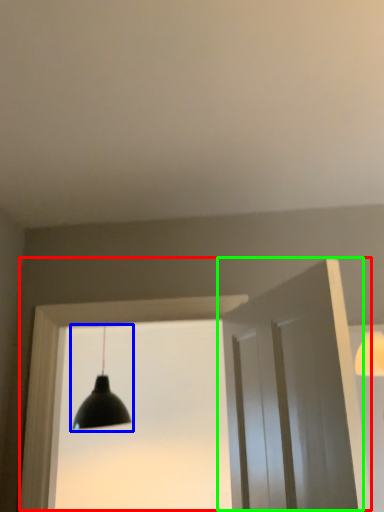
Question: Based on their relative distances, which object is farther from window frame (highlighted by a red box)? Choose from lamp (highlighted by a blue box) and door (highlighted by a green box).

Choices:
 (A) lamp
 (B) door

Answer: (A)